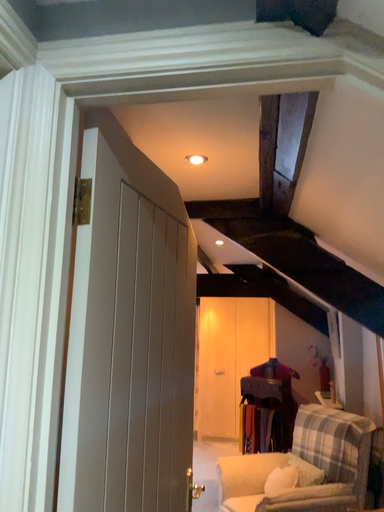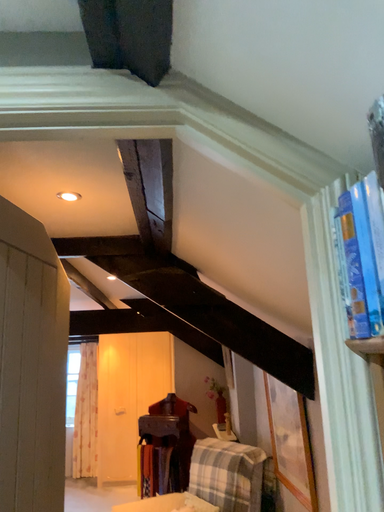
Question: How did the camera likely rotate when shooting the video?

Choices:
 (A) rotated left
 (B) rotated right

Answer: (B)